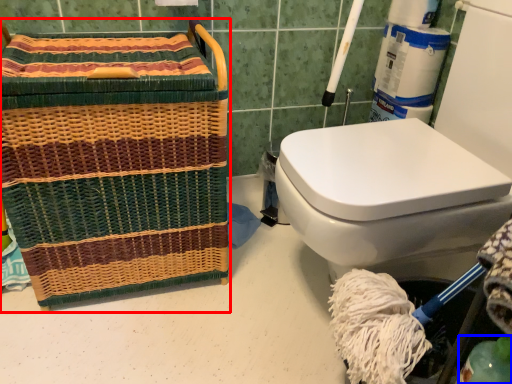
Question: Among these objects, which one is nearest to the camera, basket (highlighted by a red box) or teal (highlighted by a blue box)?

Choices:
 (A) basket
 (B) teal

Answer: (B)